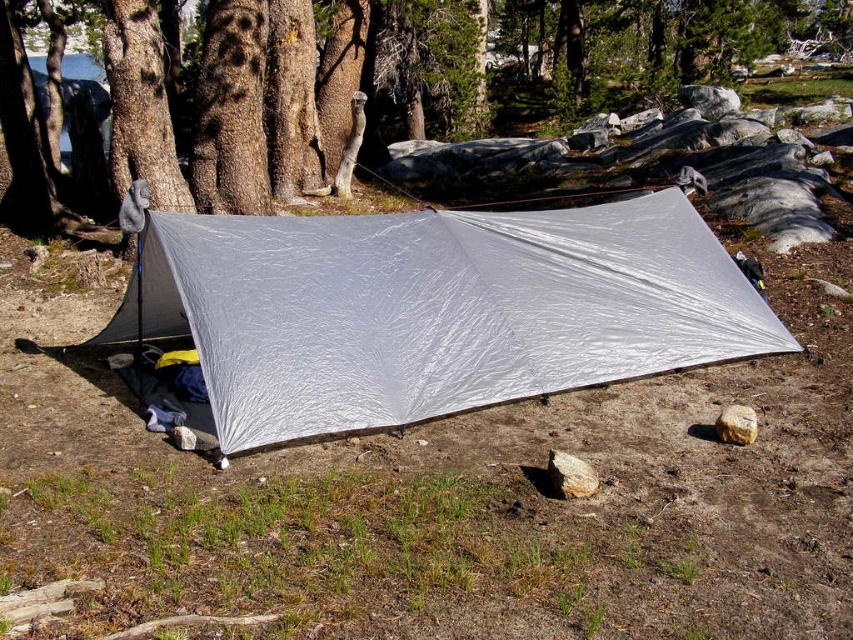
Who is positioned more to the left, silver/reflective tarp at center or smooth bark tree at center?

From the viewer's perspective, silver/reflective tarp at center appears more on the left side.

Which is more to the right, silver/reflective tarp at center or smooth bark tree at center?

smooth bark tree at center

Which is in front, point (262, 282) or point (161, 65)?

Point (262, 282) is more forward.

Locate an element on the screen. Image resolution: width=853 pixels, height=640 pixels. silver/reflective tarp at center is located at coordinates pos(439,308).